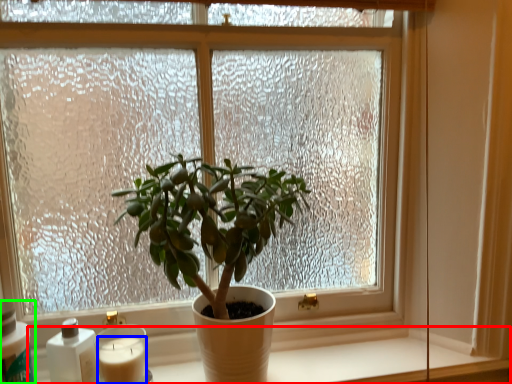
Question: Which is nearer to the window sill (highlighted by a red box)? candle (highlighted by a blue box) or bottle (highlighted by a green box).

Choices:
 (A) candle
 (B) bottle

Answer: (A)